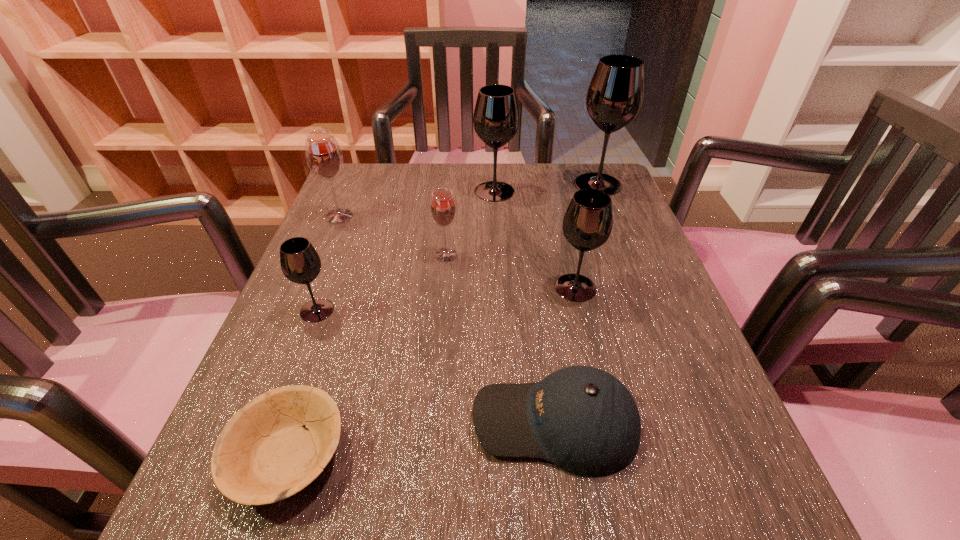
You are a GUI agent. You are given a task and a screenshot of the screen. Output one action in this format:
    pyautogui.click(x=<x>, y=<y>)
    Task: Click on the rightmost object
    Image resolution: width=960 pixels, height=540 pixels.
    Given the screenshot: What is the action you would take?
    pyautogui.click(x=615, y=95)

Locate an element on the screen. Image resolution: width=960 pixels, height=540 pixels. the tallest wineglass is located at coordinates (615, 95).

Locate an element on the screen. Image resolution: width=960 pixels, height=540 pixels. the second biggest gray wineglass is located at coordinates (496, 116).

Locate an element on the screen. The width and height of the screenshot is (960, 540). the seventh shortest object is located at coordinates (496, 116).

You are a GUI agent. You are given a task and a screenshot of the screen. Output one action in this format:
    pyautogui.click(x=<x>, y=<y>)
    Task: Click on the farther red wineglass
    This screenshot has height=540, width=960.
    Given the screenshot: What is the action you would take?
    pyautogui.click(x=323, y=154)

What are the coordinates of `the bigger red wineglass` in the screenshot? It's located at (323, 154).

At what (x,y) coordinates should I click in order to perform the action: click on the second gray wineglass from right to left. Please return your answer as a coordinate pair (x, y). This screenshot has width=960, height=540. Looking at the image, I should click on (x=587, y=224).

This screenshot has height=540, width=960. I want to click on the second wineglass from right to left, so click(x=587, y=224).

You are a GUI agent. You are given a task and a screenshot of the screen. Output one action in this format:
    pyautogui.click(x=<x>, y=<y>)
    Task: Click on the right red wineglass
    Image resolution: width=960 pixels, height=540 pixels.
    Given the screenshot: What is the action you would take?
    pyautogui.click(x=443, y=209)

Identify the location of the nearer red wineglass. (443, 209).